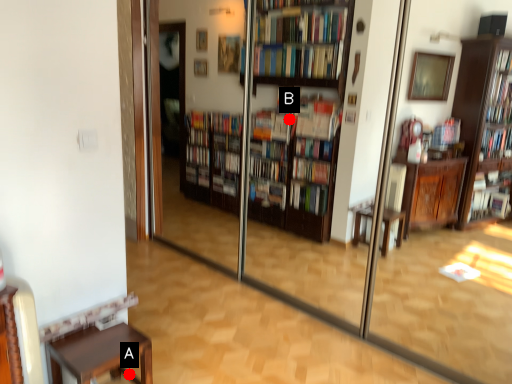
Question: Two points are circled on the image, labeled by A and B beside each circle. Which point appears closest to the camera in this image?

Choices:
 (A) A is closer
 (B) B is closer

Answer: (A)